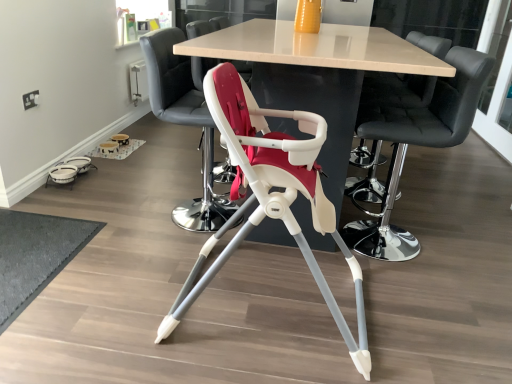
Where is `free space in front of black leather bar stool at upper center, the second chair from the right`? This screenshot has height=384, width=512. free space in front of black leather bar stool at upper center, the second chair from the right is located at coordinates (424, 291).